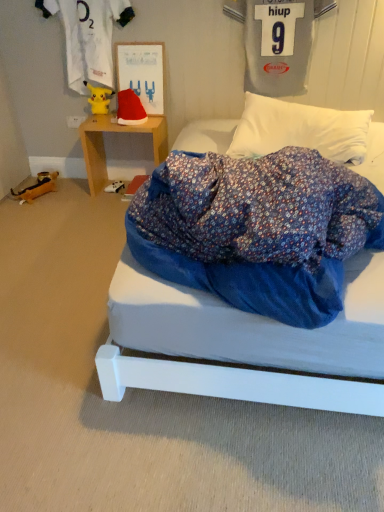
Question: From a real-world perspective, is fluffy white pillow at upper center physically located above or below wooden toy at left, which is the first toy in left-to-right order?

Choices:
 (A) below
 (B) above

Answer: (B)

Question: From the image's perspective, is fluffy white pillow at upper center positioned above or below wooden toy at left, the second toy positioned from the right?

Choices:
 (A) above
 (B) below

Answer: (A)

Question: Which is farther from the wooden table at left?

Choices:
 (A) gray jersey at upper right, positioned as the second clothing in left-to-right order
 (B) matte paperboard at upper center
 (C) wooden toy at left, the 1th toy from the bottom
 (D) yellow plush toy at upper left, which appears as the first clothing when viewed from the left
 (E) fluffy white pillow at upper center

Answer: (E)

Question: Which object is the closest to the gray jersey at upper right, positioned as the second clothing in left-to-right order?

Choices:
 (A) fluffy white pillow at upper center
 (B) wooden toy at left, the 1th toy from the bottom
 (C) matte paperboard at upper center
 (D) wooden table at left
 (E) yellow plush at upper left, which appears as the first toy when viewed from the top

Answer: (A)